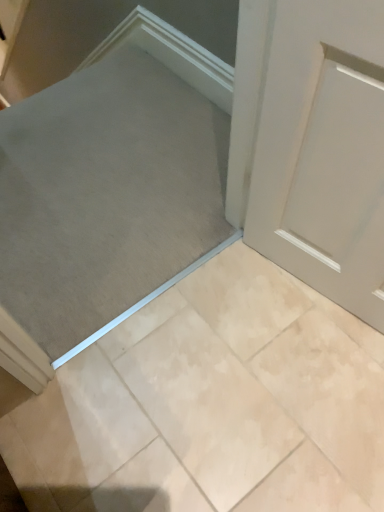
Where is `empty space that is ontop of beige marble tile at center (from a real-world perspective)`? empty space that is ontop of beige marble tile at center (from a real-world perspective) is located at coordinates (234, 393).